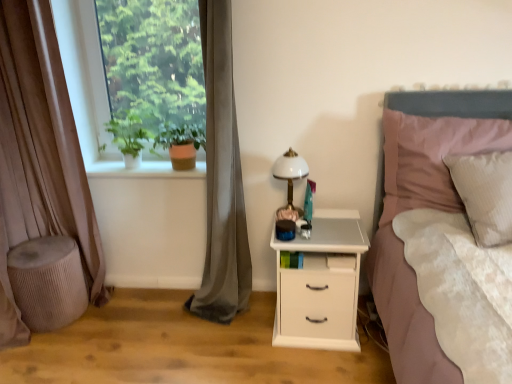
Where is `vacant area that lies between gray velvet curtain at left, positioned as the second curtain in left-to-right order, and white matte nightstand at lower right`? vacant area that lies between gray velvet curtain at left, positioned as the second curtain in left-to-right order, and white matte nightstand at lower right is located at coordinates (248, 321).